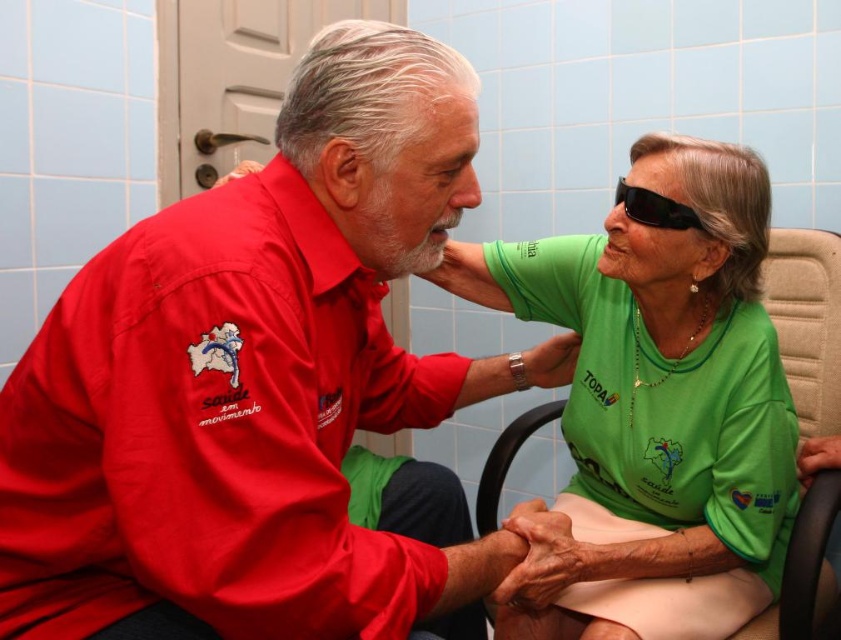
Question: Which of the following is the closest to the observer?

Choices:
 (A) (644, 184)
 (B) (667, 492)
 (C) (625, 205)
 (D) (288, 120)

Answer: (D)

Question: Which point appears closest to the camera in this image?

Choices:
 (A) (614, 196)
 (B) (512, 564)
 (C) (527, 534)
 (D) (638, 168)

Answer: (B)

Question: Which object is positioned closest to the black matte forehead at upper center?

Choices:
 (A) matte red shirt at center
 (B) green fabric shirt at center
 (C) black plastic goggles at upper right

Answer: (C)

Question: Is green fabric shirt at center below black plastic goggles at upper right?

Choices:
 (A) no
 (B) yes

Answer: (B)

Question: Is green fabric shirt at center wider than black plastic goggles at upper right?

Choices:
 (A) yes
 (B) no

Answer: (A)

Question: Does matte red shirt at center appear over black matte forehead at upper center?

Choices:
 (A) no
 (B) yes

Answer: (A)